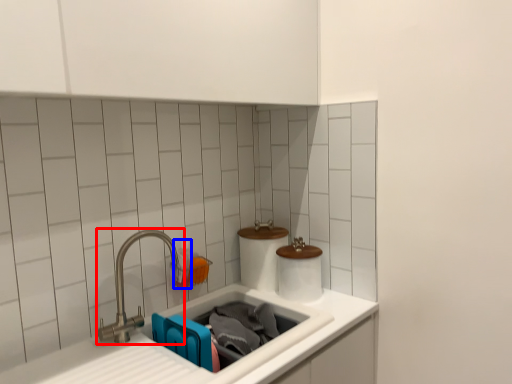
Question: Which object appears farthest to the camera in this image, tap (highlighted by a red box) or toiletry (highlighted by a blue box)?

Choices:
 (A) tap
 (B) toiletry

Answer: (B)